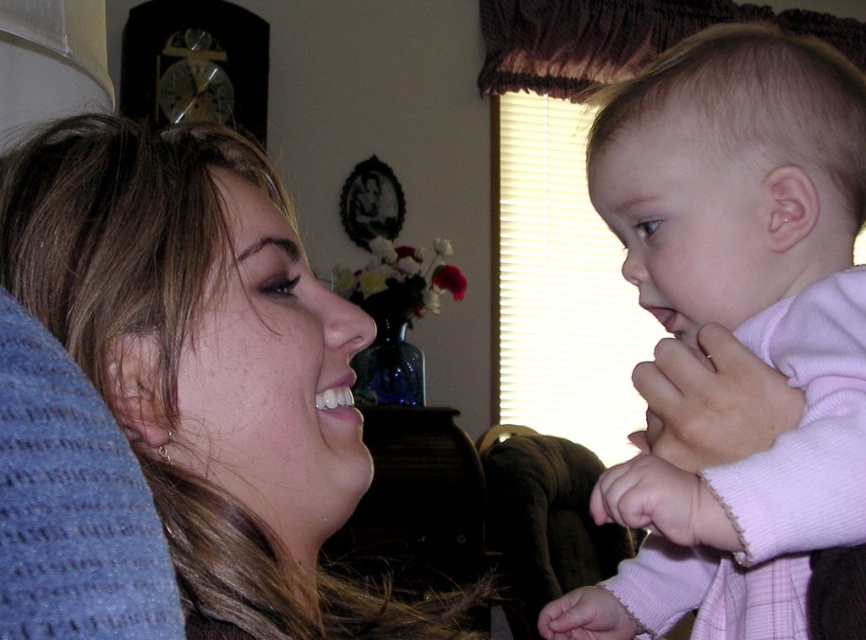
Between matte blue pillow at lower left and pink fleece baby at center, which one appears on the right side from the viewer's perspective?

pink fleece baby at center

Describe the element at coordinates (209, 365) in the screenshot. I see `matte blue pillow at lower left` at that location.

The image size is (866, 640). What do you see at coordinates (209, 365) in the screenshot?
I see `matte blue pillow at lower left` at bounding box center [209, 365].

Find the location of `matte blue pillow at lower left`. matte blue pillow at lower left is located at coordinates (209, 365).